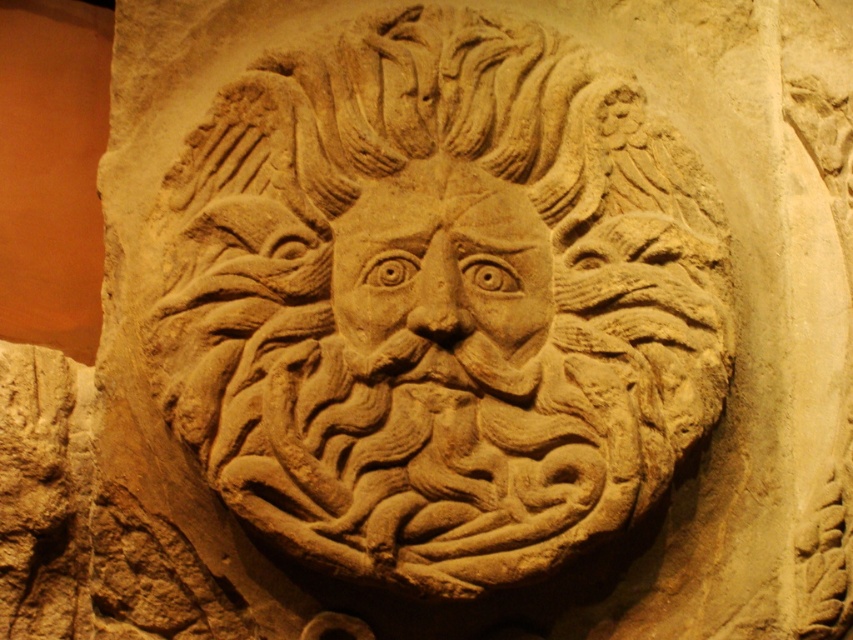
You are an art conservator examining the beige stone carving at center and the beige stone face at center in the image. Which object is taller?

The beige stone carving at center is taller than the beige stone face at center.

You are an archaeologist examining the stone relief. You notice two points marked on the relief. The first point is at coordinate point (581, 364), and the second is at point (427, 307). From your vantage point, which point appears closer to you?

Point (427, 307) appears closer to you because it is in front of point (581, 364), which is positioned behind it according to the relief.

You are an art conservator examining the beige stone carving at center and the beige stone face at center in the image. Which object is located above the other?

The beige stone carving at center is positioned over the beige stone face at center, so the beige stone carving at center is above the beige stone face at center.